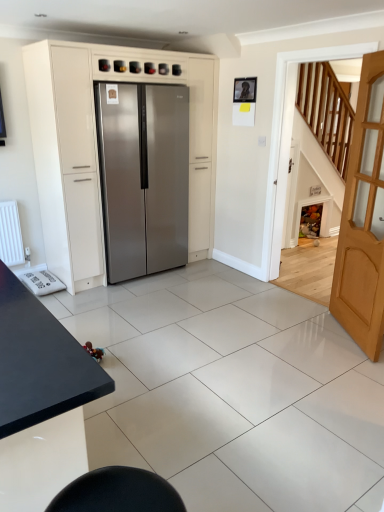
Question: In the image, is stainless steel refrigerator at center on the left side or the right side of satin silver refrigerator at center?

Choices:
 (A) right
 (B) left

Answer: (A)

Question: From a real-world perspective, is stainless steel refrigerator at center above or below satin silver refrigerator at center?

Choices:
 (A) below
 (B) above

Answer: (A)

Question: Estimate the real-world distances between objects in this image. Which object is farther from the light brown wooden door at right?

Choices:
 (A) stainless steel refrigerator at center
 (B) satin silver refrigerator at center
 (C) black matte table at lower left

Answer: (C)

Question: Estimate the real-world distances between objects in this image. Which object is farther from the satin silver refrigerator at center?

Choices:
 (A) black matte table at lower left
 (B) light brown wooden door at right
 (C) stainless steel refrigerator at center

Answer: (A)